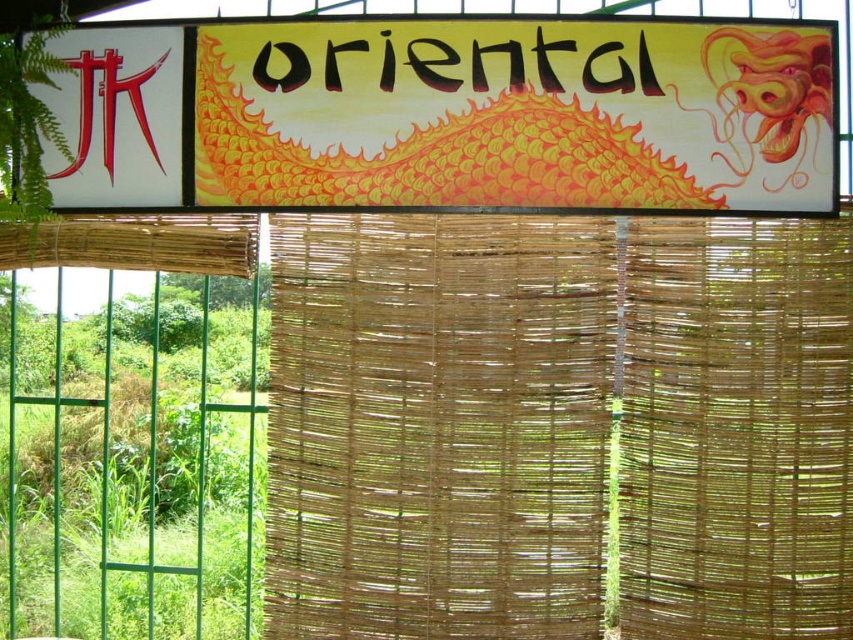
You are standing in front of a signboard with a dragon illustration. There is a specific point marked at coordinates (560, 426). What object is located at this point?

The point at coordinates (560, 426) is occupied by natural woven bamboo at center.

Based on the photo, you are standing in front of the signboard and want to see the background beyond the bamboo screen. Which of the two points, point (772, 272) or point (602, 28), would allow you to see more of the background?

Point (602, 28) allows you to see more of the background because it is in front of point (772, 272).